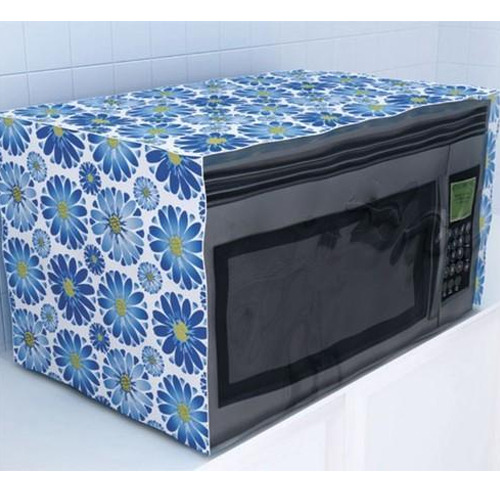
At what (x,y) coordinates should I click in order to perform the action: click on door. Please return your answer as a coordinate pair (x, y). Looking at the image, I should click on (307, 200), (424, 169), (222, 417), (421, 328), (229, 222).